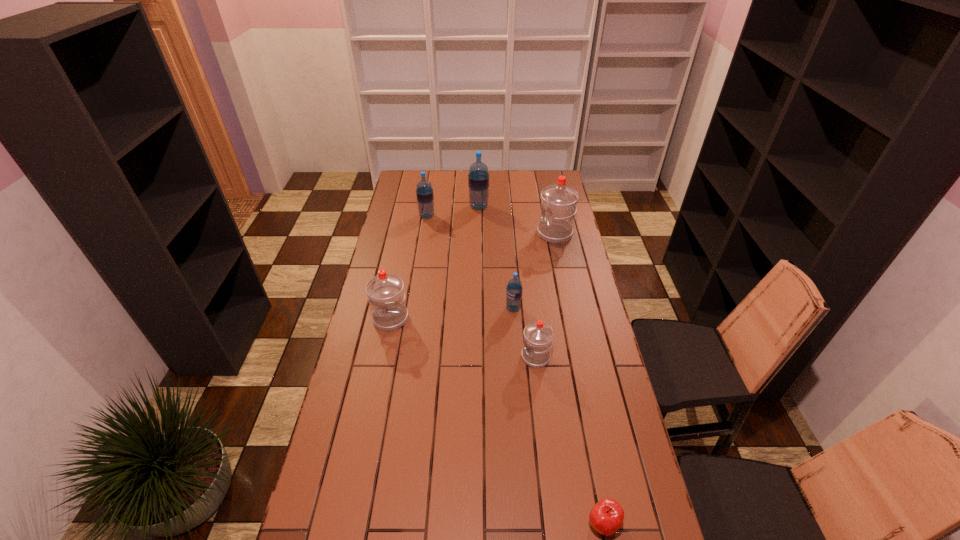
Choose which object is the second nearest neighbor to the second smallest blue water bottle. Please provide its 2D coordinates. Your answer should be formatted as a tuple, i.e. [(x, y)], where the tuple contains the x and y coordinates of a point satisfying the conditions above.

[(559, 201)]

Choose which water bottle is the third nearest neighbor to the second nearest object. Please provide its 2D coordinates. Your answer should be formatted as a tuple, i.e. [(x, y)], where the tuple contains the x and y coordinates of a point satisfying the conditions above.

[(559, 201)]

Locate which water bottle is the third closest to the biggest blue water bottle. Please provide its 2D coordinates. Your answer should be formatted as a tuple, i.e. [(x, y)], where the tuple contains the x and y coordinates of a point satisfying the conditions above.

[(514, 289)]

The width and height of the screenshot is (960, 540). I want to click on blue water bottle that is the second closest to the rightmost blue water bottle, so click(424, 192).

Locate which blue water bottle is the third closest to the sixth farthest object. Please provide its 2D coordinates. Your answer should be formatted as a tuple, i.e. [(x, y)], where the tuple contains the x and y coordinates of a point satisfying the conditions above.

[(424, 192)]

Identify which white water bottle is the second closest to the second biggest white water bottle. Please provide its 2D coordinates. Your answer should be formatted as a tuple, i.e. [(x, y)], where the tuple contains the x and y coordinates of a point satisfying the conditions above.

[(559, 201)]

The width and height of the screenshot is (960, 540). Identify the location of white water bottle object that ranks as the closest to the leftmost blue water bottle. (559, 201).

The height and width of the screenshot is (540, 960). Find the location of `free location that satisfies the following two spatial constraints: 1. on the front side of the rightmost blue water bottle; 2. on the left side of the fifth object from right to left`. free location that satisfies the following two spatial constraints: 1. on the front side of the rightmost blue water bottle; 2. on the left side of the fifth object from right to left is located at coordinates (478, 308).

You are a GUI agent. You are given a task and a screenshot of the screen. Output one action in this format:
    pyautogui.click(x=<x>, y=<y>)
    Task: Click on the free location that satisfies the following two spatial constraints: 1. on the front side of the third water bottle from left to right; 2. on the left side of the rightmost blue water bottle
    The image size is (960, 540).
    Given the screenshot: What is the action you would take?
    pyautogui.click(x=478, y=308)